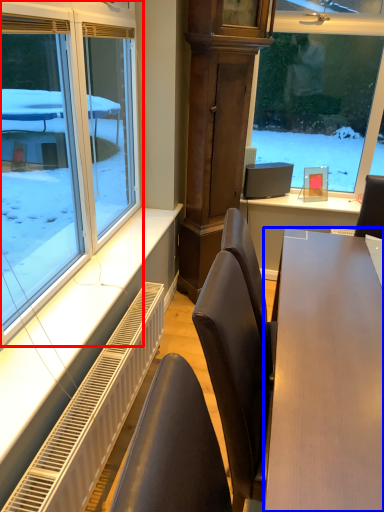
Question: Which of the following is the farthest to the observer, window (highlighted by a red box) or table (highlighted by a blue box)?

Choices:
 (A) window
 (B) table

Answer: (A)